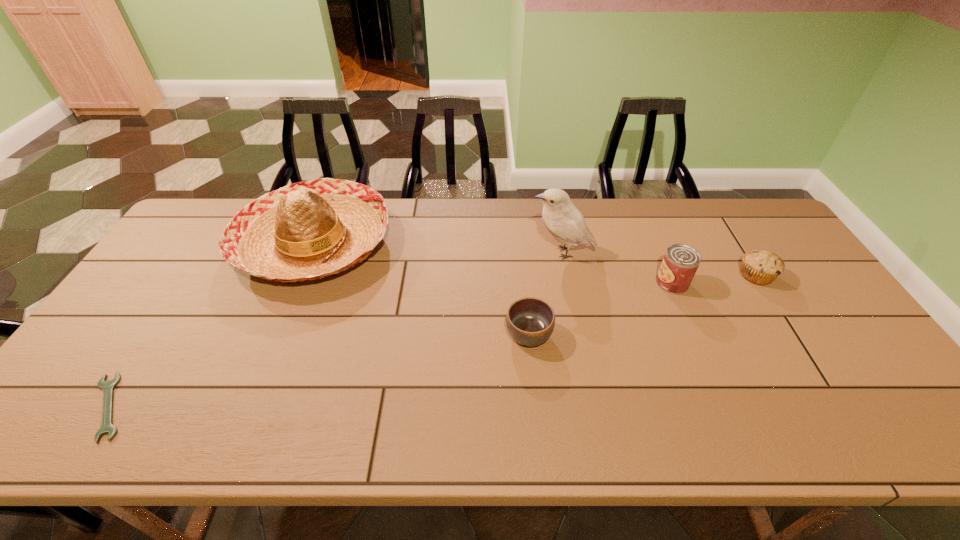
You are a GUI agent. You are given a task and a screenshot of the screen. Output one action in this format:
    pyautogui.click(x=<x>, y=<y>)
    Task: Click on the object located in the right edge section of the desktop
    The height and width of the screenshot is (540, 960).
    Given the screenshot: What is the action you would take?
    pyautogui.click(x=762, y=267)

Find the location of a particular element. The height and width of the screenshot is (540, 960). object at the near left corner is located at coordinates (107, 427).

This screenshot has height=540, width=960. In the image, there is a desktop. Identify the location of vacant region at the far edge. (697, 199).

You are a GUI agent. You are given a task and a screenshot of the screen. Output one action in this format:
    pyautogui.click(x=<x>, y=<y>)
    Task: Click on the blank area at the near edge
    The height and width of the screenshot is (540, 960).
    Given the screenshot: What is the action you would take?
    pyautogui.click(x=630, y=413)

Where is `vacant area at the left edge`? vacant area at the left edge is located at coordinates (154, 276).

The image size is (960, 540). I want to click on blank area at the right edge, so click(x=786, y=258).

The height and width of the screenshot is (540, 960). I want to click on free region at the far left corner of the desktop, so click(x=202, y=222).

The width and height of the screenshot is (960, 540). Identify the location of empty space between the tallest object and the third tallest object. (617, 268).

Where is `unoccupied area between the second object from left to right and the second nearest object`? The height and width of the screenshot is (540, 960). unoccupied area between the second object from left to right and the second nearest object is located at coordinates (x=421, y=289).

The height and width of the screenshot is (540, 960). Find the location of `vacant area that lies between the can and the muffin`. vacant area that lies between the can and the muffin is located at coordinates click(714, 279).